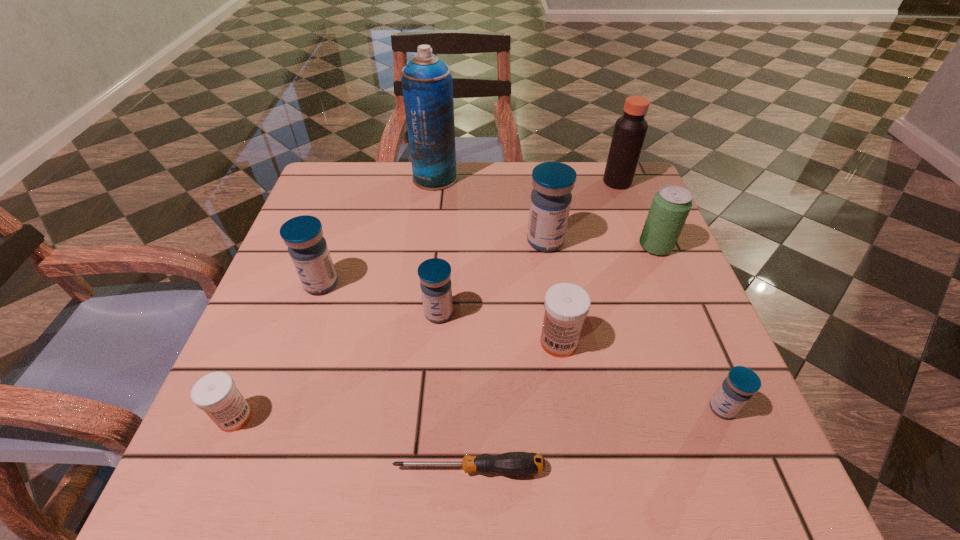
The width and height of the screenshot is (960, 540). I want to click on medicine that is at the near edge, so 216,394.

Locate an element on the screen. The width and height of the screenshot is (960, 540). screwdriver positioned at the near edge is located at coordinates (511, 463).

You are a GUI agent. You are given a task and a screenshot of the screen. Output one action in this format:
    pyautogui.click(x=<x>, y=<y>)
    Task: Click on the vinegar at the right edge
    
    Given the screenshot: What is the action you would take?
    pyautogui.click(x=630, y=129)

Where is `soda located in the right edge section of the desktop`? The height and width of the screenshot is (540, 960). soda located in the right edge section of the desktop is located at coordinates (671, 205).

Locate an element on the screen. The width and height of the screenshot is (960, 540). medicine situated at the right edge is located at coordinates (741, 383).

Image resolution: width=960 pixels, height=540 pixels. Identify the location of object that is at the near left corner. coord(216,394).

You are a GUI agent. You are given a task and a screenshot of the screen. Output one action in this format:
    pyautogui.click(x=<x>, y=<y>)
    Task: Click on the object present at the far right corner
    Image resolution: width=960 pixels, height=540 pixels.
    Given the screenshot: What is the action you would take?
    pyautogui.click(x=630, y=129)

Identify the location of vacant space at the far edge. Image resolution: width=960 pixels, height=540 pixels. (399, 215).

This screenshot has height=540, width=960. I want to click on vacant space at the left edge, so click(x=263, y=366).

You are a GUI agent. You are given a task and a screenshot of the screen. Output one action in this format:
    pyautogui.click(x=<x>, y=<y>)
    Task: Click on the free space at the right edge
    The width and height of the screenshot is (960, 540).
    Given the screenshot: What is the action you would take?
    pyautogui.click(x=659, y=276)